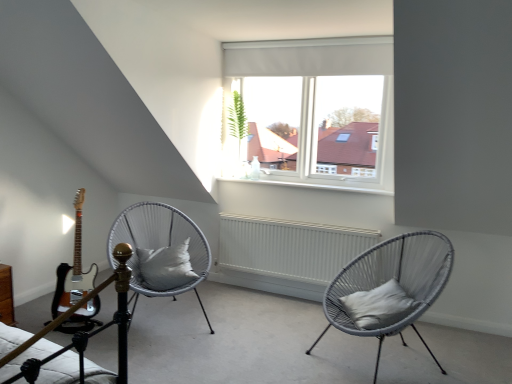
The width and height of the screenshot is (512, 384). I want to click on free space in front of white woven chair at center, placed as the 1th chair when sorted from left to right, so click(x=172, y=357).